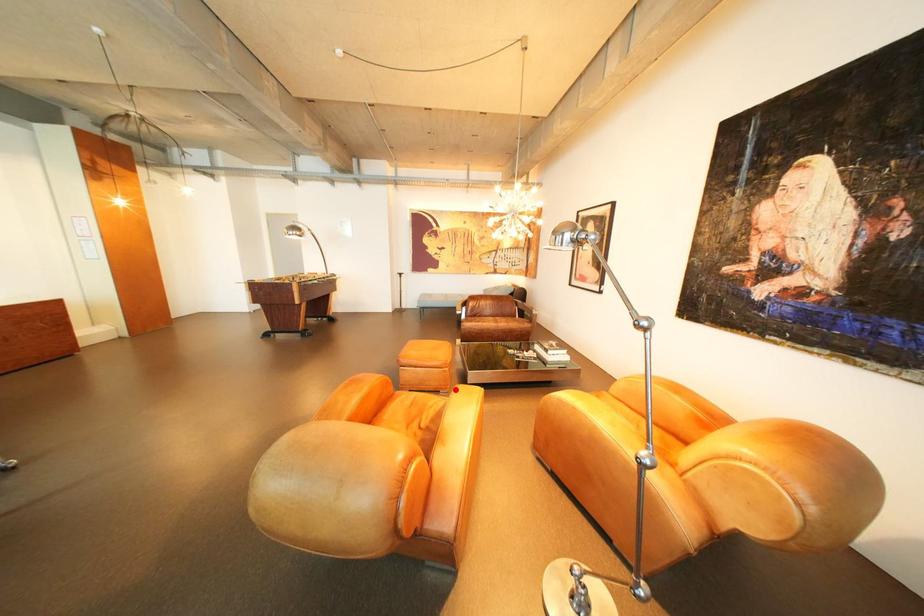
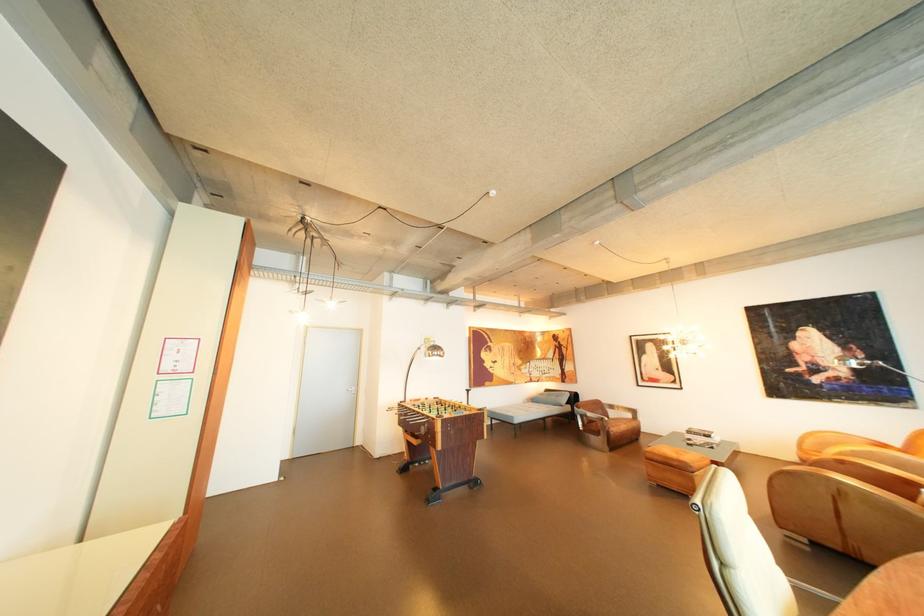
Question: I am providing you with two images of the same scene from different viewpoints. A red point is marked on the first image. Can you still see the location of the red point in image 2?

Choices:
 (A) Yes
 (B) No

Answer: (B)